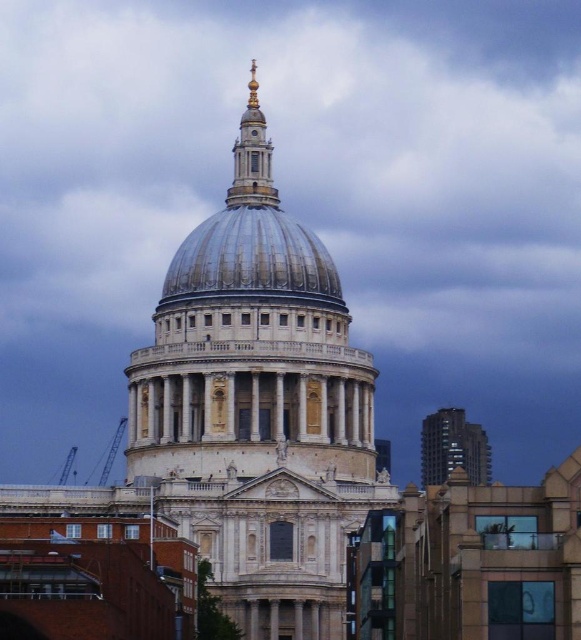
You are a tourist standing in front of St. Paul Cathedral. You see the glassy reflective skyscraper at right and the gold polished metal spire at upper center. Which object is positioned higher in the scene?

The gold polished metal spire at upper center is positioned higher in the scene than the glassy reflective skyscraper at right.

You are a tourist standing in front of St. Paul Cathedral and want to take a photo of both the white marble dome at center and the shiny metallic dome at center. Which dome should you position to the left side of your photo?

The white marble dome at center is to the left of the shiny metallic dome at center, so you should position the white marble dome at center on the left side of your photo.